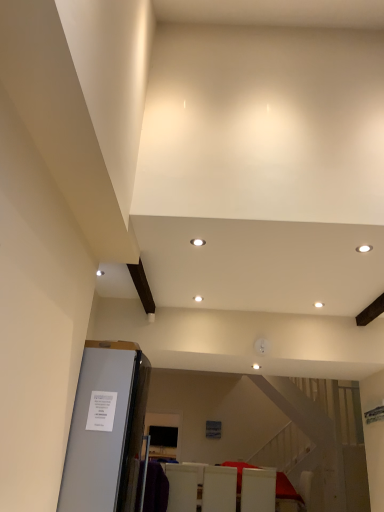
Describe the element at coordinates (182, 487) in the screenshot. I see `white matte chair at lower center, which appears as the first furniture when viewed from the left` at that location.

The height and width of the screenshot is (512, 384). What do you see at coordinates (258, 490) in the screenshot?
I see `white glossy chair at lower center, acting as the third furniture starting from the left` at bounding box center [258, 490].

How much space does white glossy chairs at lower center, the second furniture when ordered from right to left, occupy vertically?

It is 24.80 inches.

The width and height of the screenshot is (384, 512). What are the coordinates of `satin silver refrigerator at lower left` in the screenshot? It's located at (106, 429).

Is satin silver refrigerator at lower left placed right next to white matte chair at lower center, the 3th furniture in the right-to-left sequence?

No, satin silver refrigerator at lower left is not in contact with white matte chair at lower center, the 3th furniture in the right-to-left sequence.

Looking at this image, from a real-world perspective, is satin silver refrigerator at lower left physically below white matte chair at lower center, the 3th furniture in the right-to-left sequence?

Incorrect, from a real-world perspective, satin silver refrigerator at lower left is higher than white matte chair at lower center, the 3th furniture in the right-to-left sequence.

In the scene shown: Is satin silver refrigerator at lower left oriented towards white matte chair at lower center, which appears as the first furniture when viewed from the left?

No, satin silver refrigerator at lower left is not turned towards white matte chair at lower center, which appears as the first furniture when viewed from the left.

Which is nearer, (122, 476) or (186, 507)?

Positioned in front is point (122, 476).

Which object is positioned more to the left, white glossy chairs at lower center, the second furniture when ordered from right to left, or white glossy chair at lower center, acting as the third furniture starting from the left?

white glossy chairs at lower center, the second furniture when ordered from right to left, is more to the left.

In the scene shown: Can you confirm if white glossy chairs at lower center, the second furniture when ordered from right to left, is shorter than white glossy chair at lower center, acting as the third furniture starting from the left?

In fact, white glossy chairs at lower center, the second furniture when ordered from right to left, may be taller than white glossy chair at lower center, acting as the third furniture starting from the left.

Considering the sizes of objects white glossy chairs at lower center, the second furniture when ordered from right to left, and white glossy chair at lower center, acting as the third furniture starting from the left, in the image provided, who is wider, white glossy chairs at lower center, the second furniture when ordered from right to left, or white glossy chair at lower center, acting as the third furniture starting from the left,?

Wider between the two is white glossy chair at lower center, acting as the third furniture starting from the left.

Is white glossy chairs at lower center, the 2th furniture when ordered from left to right, far from white glossy chair at lower center, acting as the third furniture starting from the left?

No, white glossy chairs at lower center, the 2th furniture when ordered from left to right, is not far away from white glossy chair at lower center, acting as the third furniture starting from the left.

From the image's perspective, is white matte chair at lower center, which appears as the first furniture when viewed from the left, located beneath white glossy chairs at lower center, the second furniture when ordered from right to left?

Incorrect, from the image's perspective, white matte chair at lower center, which appears as the first furniture when viewed from the left, is higher than white glossy chairs at lower center, the second furniture when ordered from right to left.

From a real-world perspective, which is physically above, white matte chair at lower center, the 3th furniture in the right-to-left sequence, or white glossy chairs at lower center, the 2th furniture when ordered from left to right?

white glossy chairs at lower center, the 2th furniture when ordered from left to right, is physically above.

The height and width of the screenshot is (512, 384). In order to click on the 1st furniture below the white matte chair at lower center, which appears as the first furniture when viewed from the left (from the image's perspective) in this screenshot , I will do `click(219, 489)`.

Is white matte chair at lower center, the 3th furniture in the right-to-left sequence, facing towards white glossy chairs at lower center, the second furniture when ordered from right to left?

No, white matte chair at lower center, the 3th furniture in the right-to-left sequence, is not aimed at white glossy chairs at lower center, the second furniture when ordered from right to left.

Considering the relative positions of white glossy chair at lower center, acting as the third furniture starting from the left, and white matte chair at lower center, which appears as the first furniture when viewed from the left, in the image provided, is white glossy chair at lower center, acting as the third furniture starting from the left, to the right of white matte chair at lower center, which appears as the first furniture when viewed from the left, from the viewer's perspective?

Yes, white glossy chair at lower center, acting as the third furniture starting from the left, is to the right of white matte chair at lower center, which appears as the first furniture when viewed from the left.

From the image's perspective, which furniture is the 2nd one below the white matte chair at lower center, which appears as the first furniture when viewed from the left? Please provide its 2D coordinates.

[(258, 490)]

Considering their positions, is white glossy chair at lower center, the first furniture positioned from the right, located in front of or behind white matte chair at lower center, which appears as the first furniture when viewed from the left?

In the image, white glossy chair at lower center, the first furniture positioned from the right, appears behind white matte chair at lower center, which appears as the first furniture when viewed from the left.

Is white glossy chair at lower center, acting as the third furniture starting from the left, oriented away from white matte chair at lower center, the 3th furniture in the right-to-left sequence?

No, white glossy chair at lower center, acting as the third furniture starting from the left, is not facing away from white matte chair at lower center, the 3th furniture in the right-to-left sequence.

Could you measure the distance between white glossy chairs at lower center, the 2th furniture when ordered from left to right, and satin silver refrigerator at lower left?

white glossy chairs at lower center, the 2th furniture when ordered from left to right, is 3.80 meters away from satin silver refrigerator at lower left.

From the image's perspective, between white glossy chairs at lower center, the second furniture when ordered from right to left, and satin silver refrigerator at lower left, which one is located above?

satin silver refrigerator at lower left is shown above in the image.

Is point (216, 482) behind point (65, 473)?

That is True.

From a real-world perspective, between white glossy chairs at lower center, the second furniture when ordered from right to left, and satin silver refrigerator at lower left, who is vertically lower?

white glossy chairs at lower center, the second furniture when ordered from right to left, is physically lower.

Is white glossy chairs at lower center, the 2th furniture when ordered from left to right, taller or shorter than white matte chair at lower center, which appears as the first furniture when viewed from the left?

white glossy chairs at lower center, the 2th furniture when ordered from left to right, is shorter than white matte chair at lower center, which appears as the first furniture when viewed from the left.

In the scene shown: Considering the relative positions of white glossy chairs at lower center, the 2th furniture when ordered from left to right, and white matte chair at lower center, which appears as the first furniture when viewed from the left, in the image provided, is white glossy chairs at lower center, the 2th furniture when ordered from left to right, to the left or to the right of white matte chair at lower center, which appears as the first furniture when viewed from the left,?

Based on their positions, white glossy chairs at lower center, the 2th furniture when ordered from left to right, is located to the right of white matte chair at lower center, which appears as the first furniture when viewed from the left.

I want to click on furniture behind the white matte chair at lower center, which appears as the first furniture when viewed from the left, so click(x=258, y=490).

Which point is more distant from viewer, (193,472) or (241,503)?

The point (193,472) is farther from the camera.

Which object is further away from the camera, white matte chair at lower center, the 3th furniture in the right-to-left sequence, or white glossy chair at lower center, acting as the third furniture starting from the left?

white glossy chair at lower center, acting as the third furniture starting from the left, is further away from the camera.

From the image's perspective, starting from the satin silver refrigerator at lower left, which furniture is the 1st one below? Please provide its 2D coordinates.

[(182, 487)]

There is a white glossy chair at lower center, acting as the third furniture starting from the left. Find the location of `the 1st furniture above it (from the image's perspective)`. the 1st furniture above it (from the image's perspective) is located at coordinates (219, 489).

Looking at the image, which one is located further to white glossy chair at lower center, acting as the third furniture starting from the left, white glossy chairs at lower center, the 2th furniture when ordered from left to right, or satin silver refrigerator at lower left?

Among the two, satin silver refrigerator at lower left is located further to white glossy chair at lower center, acting as the third furniture starting from the left.

Considering their positions, is white glossy chair at lower center, acting as the third furniture starting from the left, positioned further to white glossy chairs at lower center, the second furniture when ordered from right to left, than satin silver refrigerator at lower left?

The object further to white glossy chairs at lower center, the second furniture when ordered from right to left, is satin silver refrigerator at lower left.

From the image, which object appears to be farther from satin silver refrigerator at lower left, white glossy chair at lower center, the first furniture positioned from the right, or white glossy chairs at lower center, the 2th furniture when ordered from left to right?

white glossy chair at lower center, the first furniture positioned from the right.

Which object lies nearer to the anchor point white glossy chairs at lower center, the second furniture when ordered from right to left, satin silver refrigerator at lower left or white matte chair at lower center, the 3th furniture in the right-to-left sequence?

white matte chair at lower center, the 3th furniture in the right-to-left sequence, is positioned closer to the anchor white glossy chairs at lower center, the second furniture when ordered from right to left.

Based on their spatial positions, is white glossy chairs at lower center, the second furniture when ordered from right to left, or white glossy chair at lower center, acting as the third furniture starting from the left, further from white matte chair at lower center, which appears as the first furniture when viewed from the left?

white glossy chair at lower center, acting as the third furniture starting from the left, is further to white matte chair at lower center, which appears as the first furniture when viewed from the left.

From the image, which object appears to be farther from white glossy chairs at lower center, the second furniture when ordered from right to left, white matte chair at lower center, the 3th furniture in the right-to-left sequence, or satin silver refrigerator at lower left?

Among the two, satin silver refrigerator at lower left is located further to white glossy chairs at lower center, the second furniture when ordered from right to left.

When comparing their distances from white matte chair at lower center, the 3th furniture in the right-to-left sequence, does satin silver refrigerator at lower left or white glossy chairs at lower center, the second furniture when ordered from right to left, seem further?

satin silver refrigerator at lower left is further to white matte chair at lower center, the 3th furniture in the right-to-left sequence.

Estimate the real-world distances between objects in this image. Which object is further from satin silver refrigerator at lower left, white matte chair at lower center, the 3th furniture in the right-to-left sequence, or white glossy chairs at lower center, the second furniture when ordered from right to left?

white glossy chairs at lower center, the second furniture when ordered from right to left, is further to satin silver refrigerator at lower left.

The width and height of the screenshot is (384, 512). Identify the location of furniture positioned between satin silver refrigerator at lower left and white matte chair at lower center, the 3th furniture in the right-to-left sequence, from near to far. (219, 489).

This screenshot has width=384, height=512. I want to click on furniture between white matte chair at lower center, the 3th furniture in the right-to-left sequence, and white glossy chair at lower center, acting as the third furniture starting from the left, in the horizontal direction, so click(x=219, y=489).